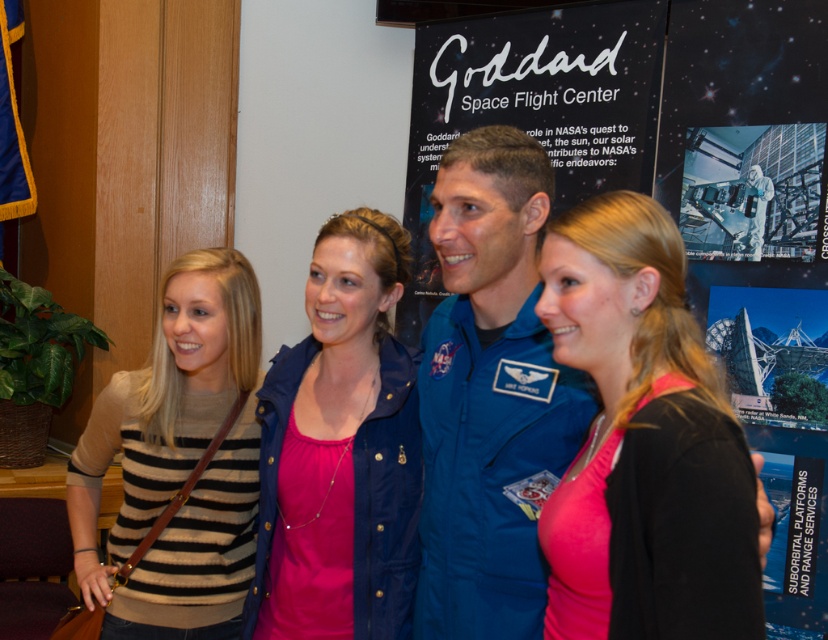
Question: Which of the following is the closest to the observer?

Choices:
 (A) (754, 209)
 (B) (790, 509)

Answer: (B)

Question: Which object is the farthest from the metallic silver satellite at upper right?

Choices:
 (A) navy blue jacket at center
 (B) black matte poster at center
 (C) blue fabric astronaut suit at center

Answer: (A)

Question: Does striped sweater at left come behind metallic silver satellite at upper right?

Choices:
 (A) yes
 (B) no

Answer: (B)

Question: Which object is farther from the camera taking this photo?

Choices:
 (A) black matte poster at center
 (B) striped sweater at left

Answer: (A)

Question: Is pink matte shirt at center wider than blue fabric astronaut suit at center?

Choices:
 (A) yes
 (B) no

Answer: (B)

Question: Is blue fabric astronaut suit at center wider than navy blue jacket at center?

Choices:
 (A) no
 (B) yes

Answer: (A)